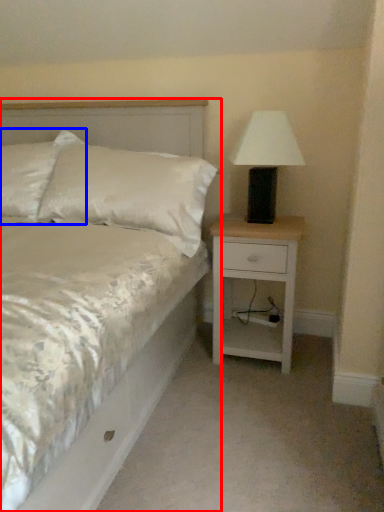
Question: Which object is further to the camera taking this photo, bed (highlighted by a red box) or pillow (highlighted by a blue box)?

Choices:
 (A) bed
 (B) pillow

Answer: (B)